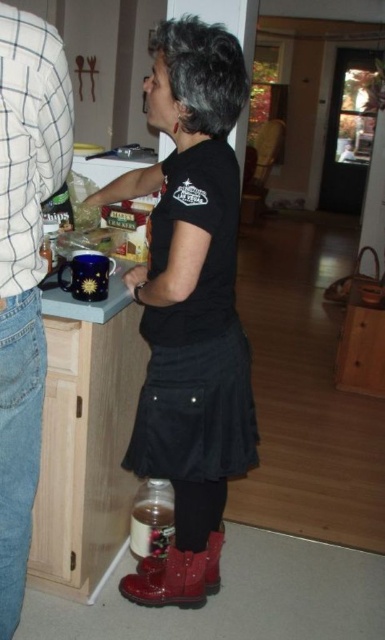
Question: Is shiny patent leather boots at lower center bigger than denim jeans at left?

Choices:
 (A) yes
 (B) no

Answer: (A)

Question: Does shiny patent leather boots at lower center have a smaller size compared to denim jeans at left?

Choices:
 (A) no
 (B) yes

Answer: (A)

Question: Which object appears closest to the camera in this image?

Choices:
 (A) denim jeans at left
 (B) shiny patent leather boots at lower center

Answer: (A)

Question: Is the position of shiny patent leather boots at lower center less distant than that of denim jeans at left?

Choices:
 (A) yes
 (B) no

Answer: (B)